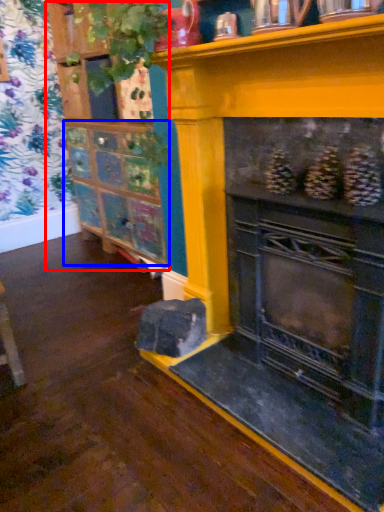
Question: Which object is further to the camera taking this photo, shelf (highlighted by a red box) or shelf (highlighted by a blue box)?

Choices:
 (A) shelf
 (B) shelf

Answer: (B)